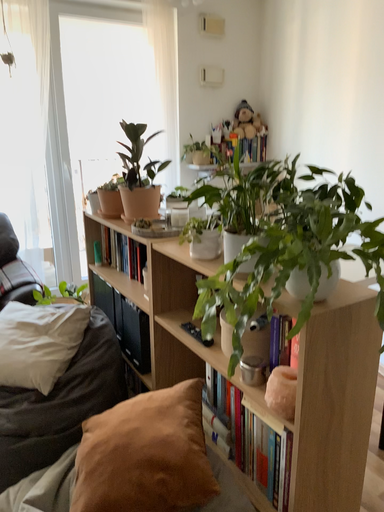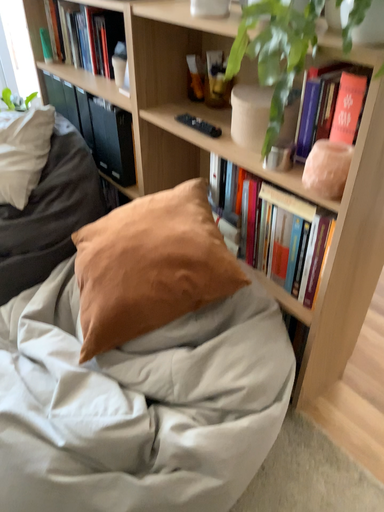
Question: How did the camera likely rotate when shooting the video?

Choices:
 (A) rotated downward
 (B) rotated upward

Answer: (A)